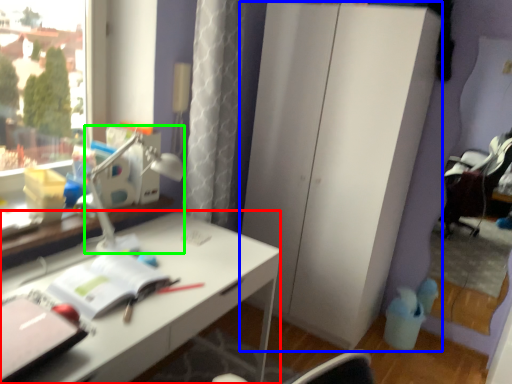
Question: Considering the real-world distances, which object is farthest from desk (highlighted by a red box)? dresser (highlighted by a blue box) or table lamp (highlighted by a green box)?

Choices:
 (A) dresser
 (B) table lamp

Answer: (A)